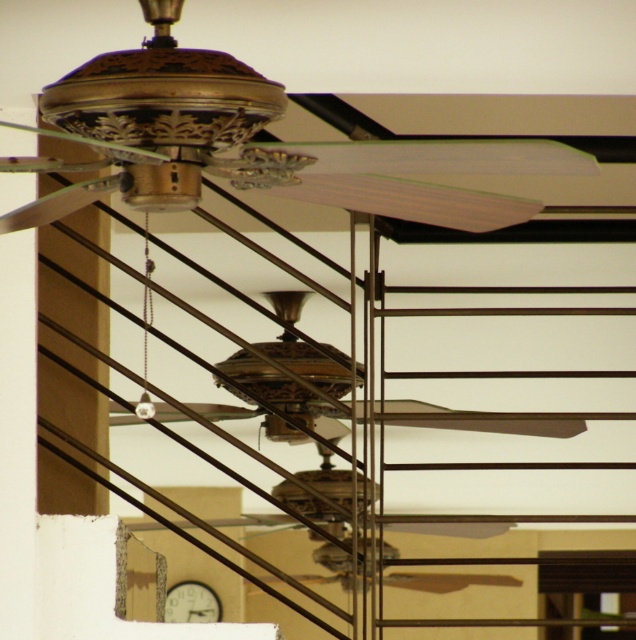
Question: Which point appears closest to the camera in this image?

Choices:
 (A) (177, 593)
 (B) (128, 109)

Answer: (B)

Question: Is gold metallic fan at upper center wider than white wooden clock at lower center?

Choices:
 (A) yes
 (B) no

Answer: (A)

Question: Which object appears farthest from the camera in this image?

Choices:
 (A) white wooden clock at lower center
 (B) gold metallic fan at upper center
 (C) gold metallic fan at center

Answer: (A)

Question: Is gold metallic fan at center in front of white wooden clock at lower center?

Choices:
 (A) yes
 (B) no

Answer: (A)

Question: Which point is closer to the camera?

Choices:
 (A) gold metallic fan at center
 (B) gold metallic fan at upper center
 (C) white wooden clock at lower center

Answer: (B)

Question: Can you confirm if gold metallic fan at upper center is positioned to the left of gold metallic fan at center?

Choices:
 (A) yes
 (B) no

Answer: (A)